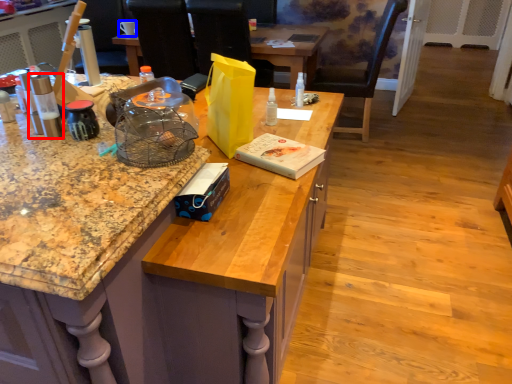
Question: Which point is closer to the camera, kitchen appliance (highlighted by a red box) or coffee cup (highlighted by a blue box)?

Choices:
 (A) kitchen appliance
 (B) coffee cup

Answer: (A)